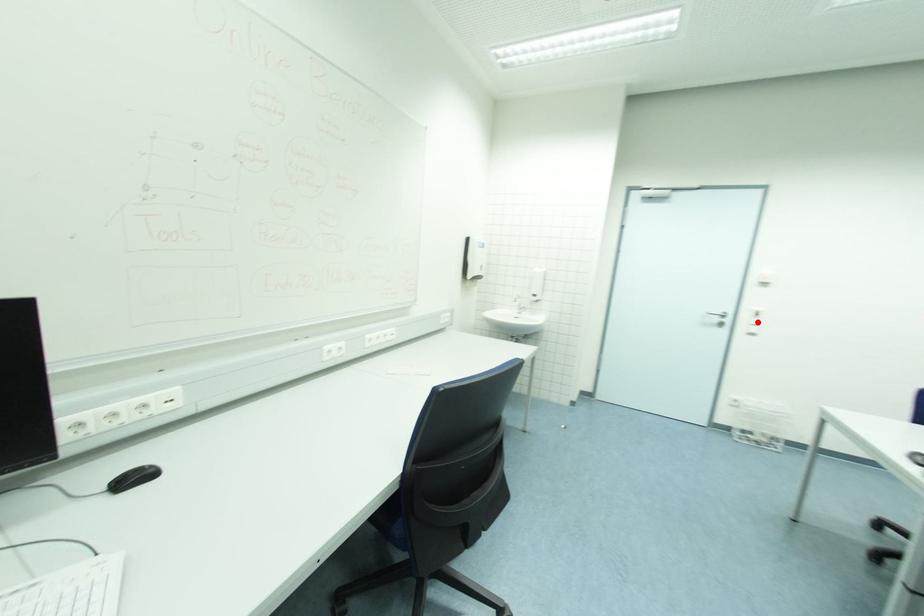
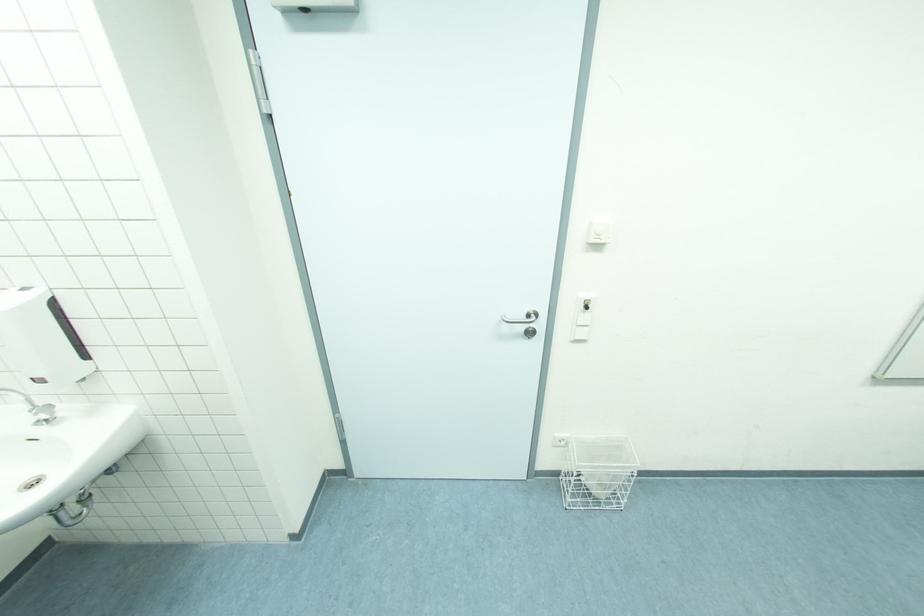
The point at the highlighted location is marked in the first image. Where is the corresponding point in the second image?

(589, 318)